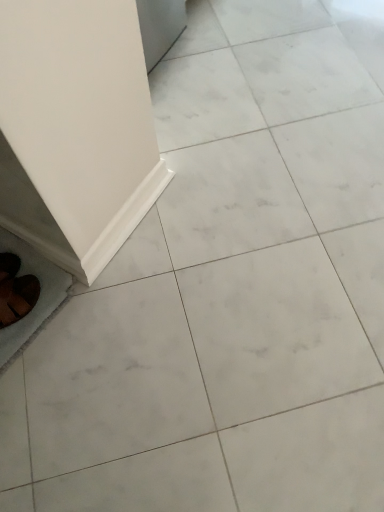
Question: Is brown suede shoes at lower left shorter than white glossy baseboard at lower left, the second ceramic tile from the left?

Choices:
 (A) yes
 (B) no

Answer: (B)

Question: Considering the relative sizes of brown suede shoes at lower left and white glossy baseboard at lower left, the second ceramic tile from the left, in the image provided, is brown suede shoes at lower left taller than white glossy baseboard at lower left, the second ceramic tile from the left,?

Choices:
 (A) no
 (B) yes

Answer: (B)

Question: From a real-world perspective, is brown suede shoes at lower left below white glossy baseboard at lower left, the second ceramic tile from the left?

Choices:
 (A) no
 (B) yes

Answer: (A)

Question: Does brown suede shoes at lower left have a lesser width compared to white glossy baseboard at lower left, the second ceramic tile from the left?

Choices:
 (A) yes
 (B) no

Answer: (B)

Question: Could you tell me if brown suede shoes at lower left is turned towards white glossy baseboard at lower left, which appears as the 1th ceramic tile when viewed from the right?

Choices:
 (A) no
 (B) yes

Answer: (A)

Question: From the image's perspective, is brown suede shoes at lower left on top of white glossy baseboard at lower left, the second ceramic tile from the left?

Choices:
 (A) yes
 (B) no

Answer: (B)

Question: Does white glossy baseboard at lower left, the second ceramic tile from the left, turn towards white glossy ceramic tile at lower left, the first ceramic tile viewed from the left?

Choices:
 (A) yes
 (B) no

Answer: (B)

Question: Can you confirm if white glossy baseboard at lower left, which appears as the 1th ceramic tile when viewed from the right, is thinner than white glossy ceramic tile at lower left, which appears as the 2th ceramic tile when viewed from the right?

Choices:
 (A) no
 (B) yes

Answer: (B)

Question: Does white glossy baseboard at lower left, which appears as the 1th ceramic tile when viewed from the right, come behind white glossy ceramic tile at lower left, which appears as the 2th ceramic tile when viewed from the right?

Choices:
 (A) yes
 (B) no

Answer: (A)

Question: Is white glossy baseboard at lower left, the second ceramic tile from the left, positioned in front of white glossy ceramic tile at lower left, which appears as the 2th ceramic tile when viewed from the right?

Choices:
 (A) yes
 (B) no

Answer: (B)

Question: Does white glossy baseboard at lower left, which appears as the 1th ceramic tile when viewed from the right, have a lesser height compared to white glossy ceramic tile at lower left, which appears as the 2th ceramic tile when viewed from the right?

Choices:
 (A) no
 (B) yes

Answer: (A)

Question: From a real-world perspective, does white glossy baseboard at lower left, the second ceramic tile from the left, sit lower than white glossy ceramic tile at lower left, the first ceramic tile viewed from the left?

Choices:
 (A) yes
 (B) no

Answer: (B)

Question: Can we say brown suede shoes at lower left lies outside white glossy ceramic tile at lower left, the first ceramic tile viewed from the left?

Choices:
 (A) no
 (B) yes

Answer: (A)